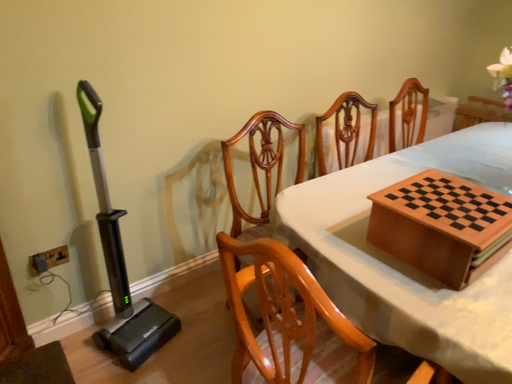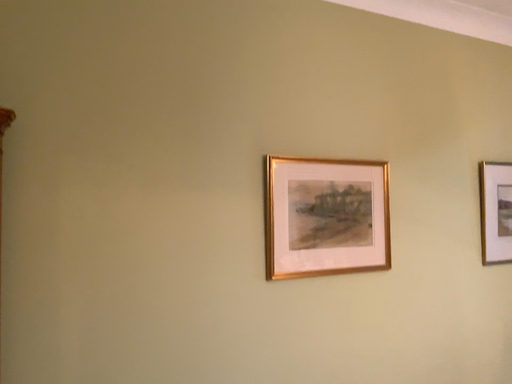
Question: How did the camera likely rotate when shooting the video?

Choices:
 (A) rotated upward
 (B) rotated downward

Answer: (A)